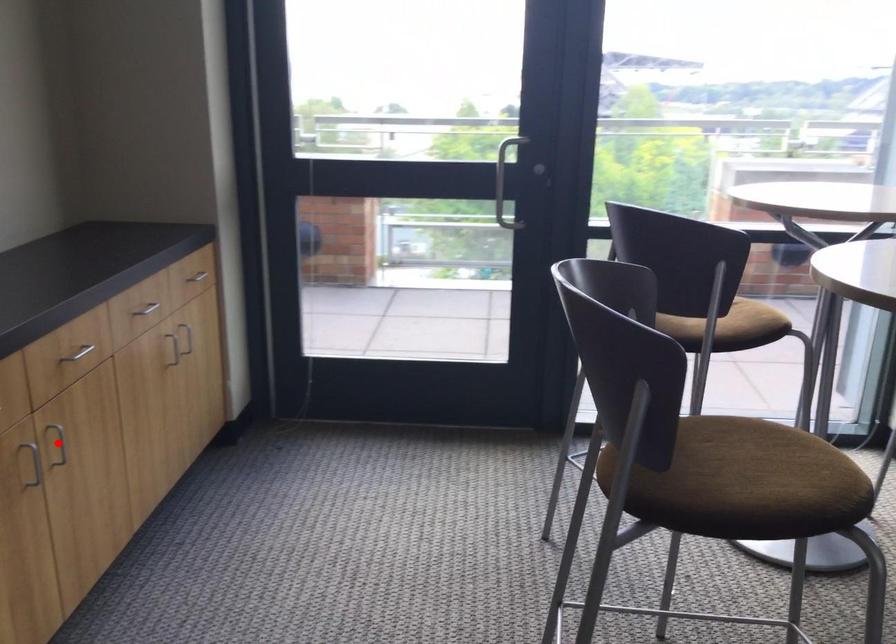
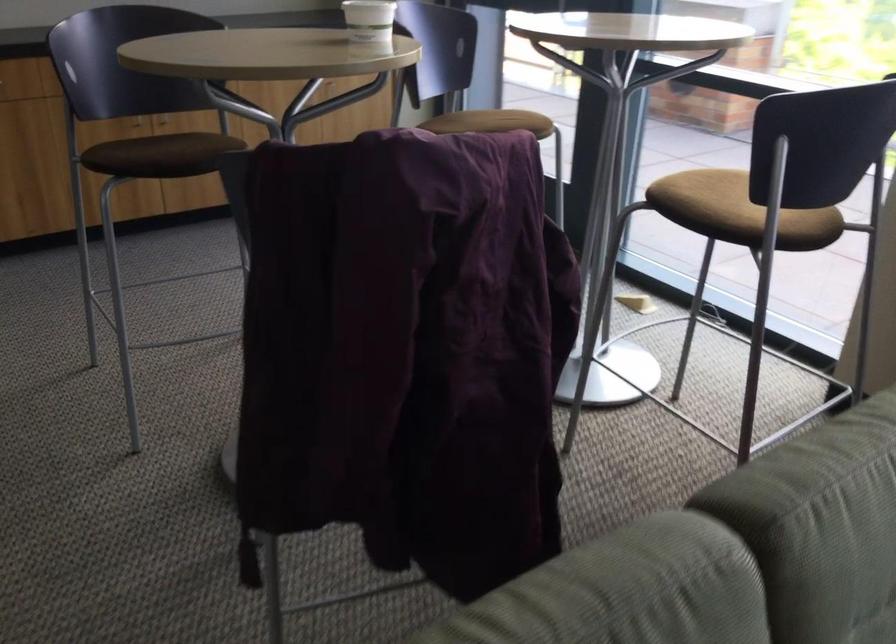
Question: I am providing you with two images of the same scene from different viewpoints. A red point is marked on the first image. Can you still see the location of the red point in image 2?

Choices:
 (A) Yes
 (B) No

Answer: (B)